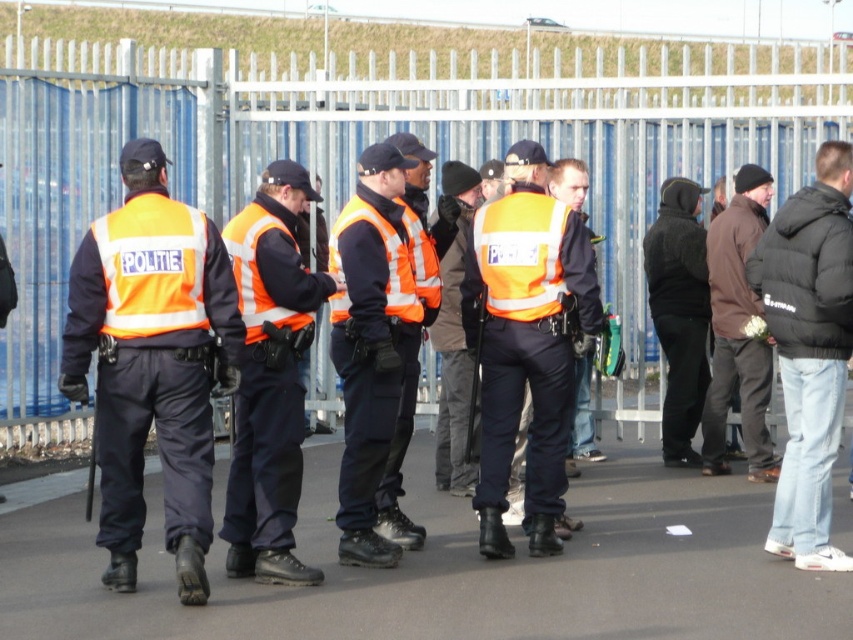
In the scene shown: You are a police officer in the group and need to move from your current position to a checkpoint located at point (727, 280). There is an obstacle at point (262, 323). Will you have to go around the obstacle to reach the checkpoint?

Point (262, 323) is in front of point (727, 280), so you will have to go around the obstacle at point (262, 323) to reach the checkpoint at point (727, 280).